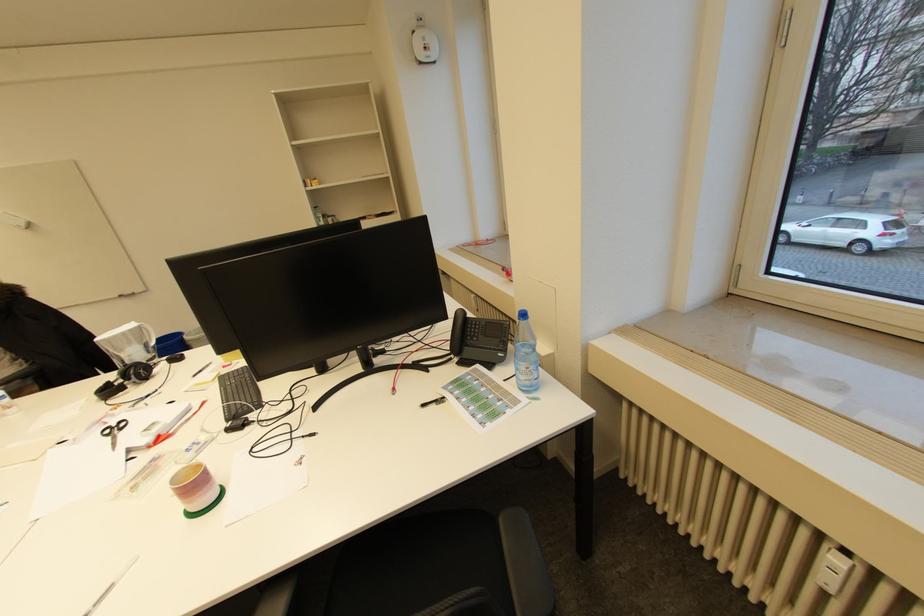
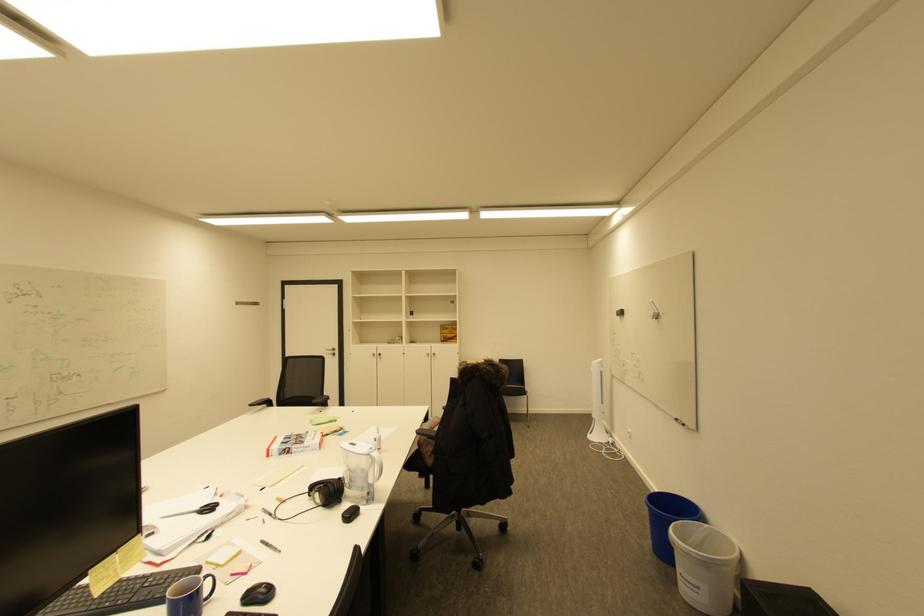
Find the pixel in the second image that matches point (127, 422) in the first image.

(220, 508)